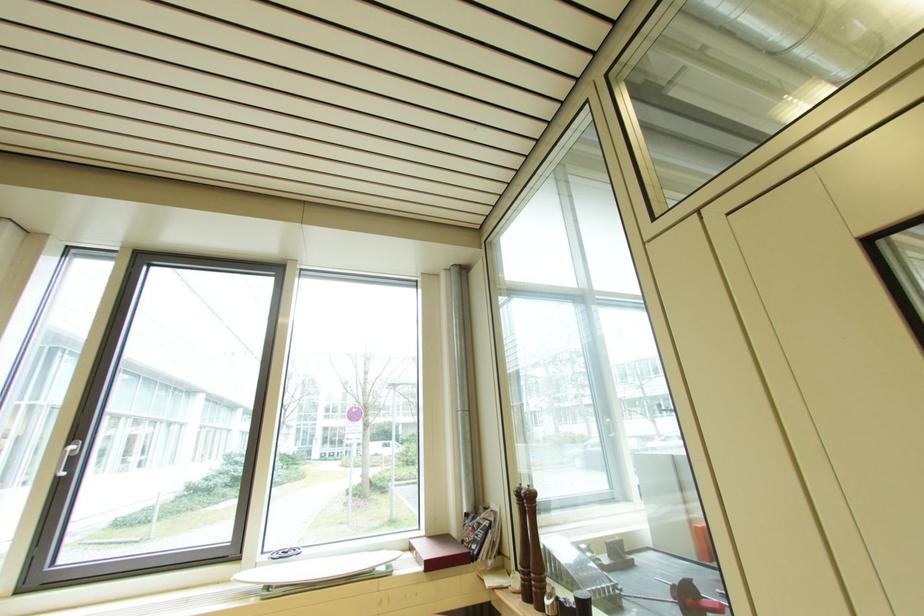
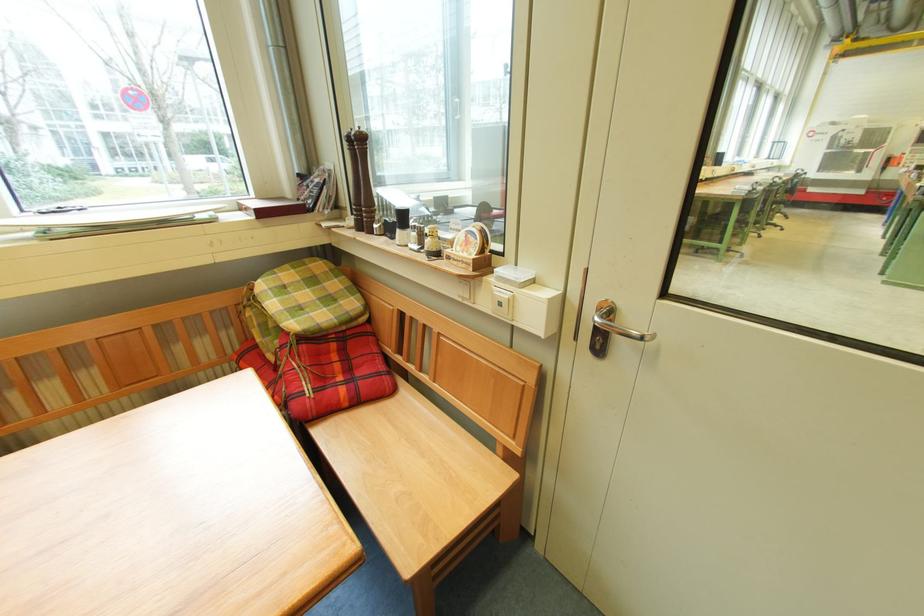
Locate, in the second image, the point that corresponds to (x=524, y=498) in the first image.

(354, 144)